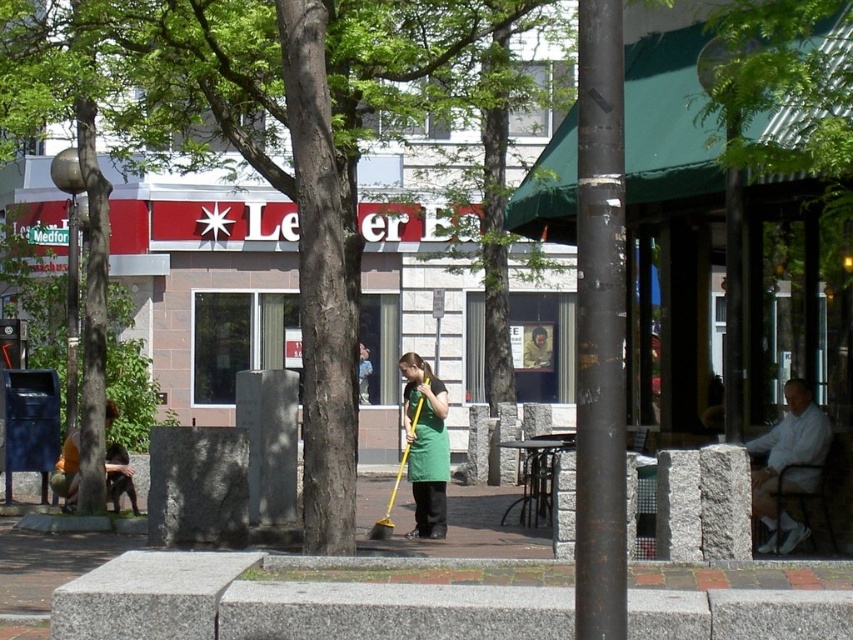
Is green leafy tree at center below orange shirt at lower left?

Actually, green leafy tree at center is above orange shirt at lower left.

Identify the location of green leafy tree at center. (265, 134).

Between green fabric apron at center and orange shirt at lower left, which one is positioned higher?

Positioned higher is green fabric apron at center.

Does green fabric apron at center have a greater width compared to orange shirt at lower left?

Incorrect, green fabric apron at center's width does not surpass orange shirt at lower left's.

Locate an element on the screen. green fabric apron at center is located at coordinates (425, 445).

Does rusty metal pole at center appear under orange shirt at lower left?

Incorrect, rusty metal pole at center is not positioned below orange shirt at lower left.

This screenshot has height=640, width=853. In order to click on rusty metal pole at center in this screenshot , I will do `click(601, 326)`.

This screenshot has width=853, height=640. I want to click on rusty metal pole at center, so click(x=601, y=326).